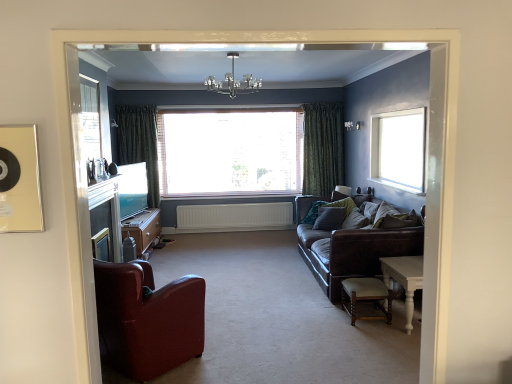
Locate an element on the screen. The image size is (512, 384). vacant location below light beige leather stool at lower right (from a real-world perspective) is located at coordinates (370, 322).